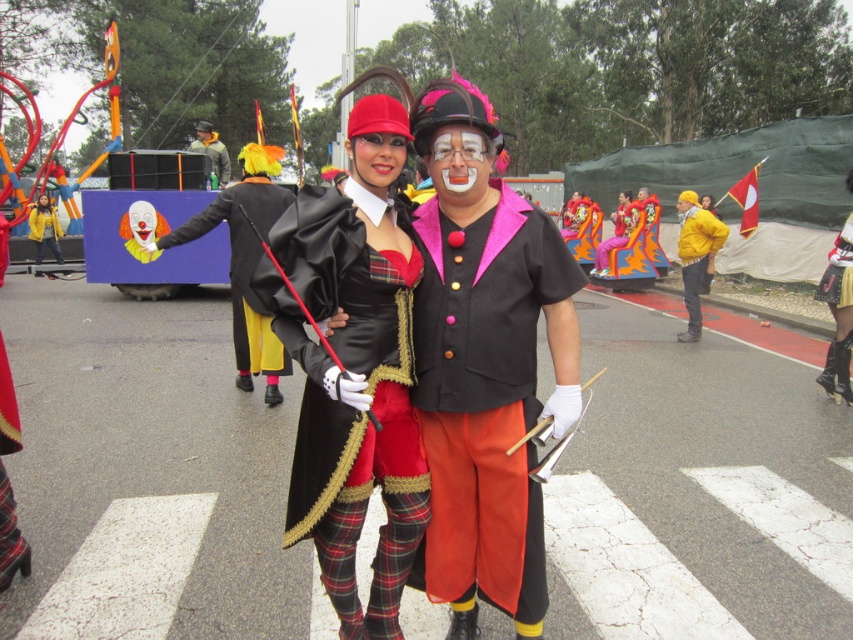
You are a parade attendee who wants to take a photo with both the matte black clown mask at center and the matte yellow clown nose at center. Since you want to ensure both are clearly visible in the photo, which object should you position closer to the camera to make them appear the same size?

To make the matte black clown mask at center and the matte yellow clown nose at center appear the same size in the photo, position the larger matte black clown mask at center farther away from the camera compared to the smaller matte yellow clown nose at center.

You are a photographer trying to capture the matte black hat at center and the matte yellow clown mask at center in the same frame. Which object should you focus on first to ensure both are in focus?

The matte black hat at center is closer to the viewer than the matte yellow clown mask at center. To ensure both are in focus, you should focus on the matte black hat at center first, as it is the closer object.

You are a costume designer trying to store the satin black coat at center and the black satin cape at center in a small storage box. Which item will you place first to ensure both fit?

The satin black coat at center occupies less space than the black satin cape at center, so place the black satin cape at center first to make room for the smaller coat.